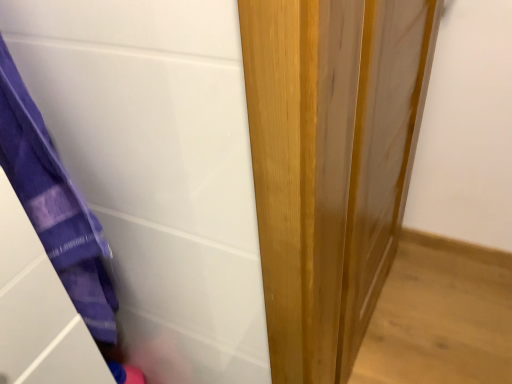
Image resolution: width=512 pixels, height=384 pixels. Find the location of `purple fabric at left`. purple fabric at left is located at coordinates (158, 167).

What is the approximate height of purple fabric at left?

purple fabric at left is 28.17 inches tall.

The width and height of the screenshot is (512, 384). Describe the element at coordinates (158, 167) in the screenshot. I see `purple fabric at left` at that location.

What is the approximate width of wooden door at center?

4.20 inches.

Identify the location of wooden door at center. (331, 164).

This screenshot has width=512, height=384. Describe the element at coordinates (331, 164) in the screenshot. I see `wooden door at center` at that location.

Identify the location of purple fabric at left. (158, 167).

Which object is positioned more to the left, purple fabric at left or wooden door at center?

Positioned to the left is purple fabric at left.

Looking at this image, does purple fabric at left lie in front of wooden door at center?

Yes, it is.

Is point (3, 37) more distant than point (394, 178)?

No, (3, 37) is in front of (394, 178).

From the image's perspective, would you say purple fabric at left is shown under wooden door at center?

Yes, from the image's perspective, purple fabric at left is below wooden door at center.

From a real-world perspective, which object rests below the other?

In real-world perspective, wooden door at center is lower.

Considering the sizes of objects purple fabric at left and wooden door at center in the image provided, who is wider, purple fabric at left or wooden door at center?

Wider between the two is purple fabric at left.

Considering the sizes of objects purple fabric at left and wooden door at center in the image provided, who is taller, purple fabric at left or wooden door at center?

wooden door at center is taller.

Can you confirm if purple fabric at left is smaller than wooden door at center?

Yes, purple fabric at left is smaller than wooden door at center.

Is purple fabric at left outside of wooden door at center?

Indeed, purple fabric at left is completely outside wooden door at center.

Is purple fabric at left touching wooden door at center?

No, purple fabric at left is not in contact with wooden door at center.

Is purple fabric at left looking in the opposite direction of wooden door at center?

That's not correct — purple fabric at left is not looking away from wooden door at center.

How many degrees apart are the facing directions of purple fabric at left and wooden door at center?

The angle between the facing direction of purple fabric at left and the facing direction of wooden door at center is 0.947 degrees.

Measure the distance from purple fabric at left to wooden door at center.

purple fabric at left and wooden door at center are 10.08 inches apart.

Find the location of a particular element. screen door above the wooden door at center (from a real-world perspective) is located at coordinates (158, 167).

Does wooden door at center appear on the right side of purple fabric at left?

Correct, you'll find wooden door at center to the right of purple fabric at left.

In the image, is wooden door at center positioned in front of or behind purple fabric at left?

wooden door at center is positioned farther from the viewer than purple fabric at left.

Which is in front, point (379, 148) or point (208, 86)?

The point (208, 86) is closer.

From the image's perspective, between wooden door at center and purple fabric at left, who is located below?

From the image's view, purple fabric at left is below.

From a real-world perspective, which is physically above, wooden door at center or purple fabric at left?

purple fabric at left, from a real-world perspective.

Between wooden door at center and purple fabric at left, which one has larger width?

With larger width is purple fabric at left.

Considering the sizes of objects wooden door at center and purple fabric at left in the image provided, who is shorter, wooden door at center or purple fabric at left?

Standing shorter between the two is purple fabric at left.

In terms of size, does wooden door at center appear bigger or smaller than purple fabric at left?

Clearly, wooden door at center is larger in size than purple fabric at left.

Is wooden door at center not inside purple fabric at left?

Indeed, wooden door at center is completely outside purple fabric at left.

Is wooden door at center far from purple fabric at left?

No, wooden door at center is not far away from purple fabric at left.

From the picture: Is wooden door at center facing away from purple fabric at left?

No, purple fabric at left is not at the back of wooden door at center.

Can you tell me how much wooden door at center and purple fabric at left differ in facing direction?

0.947 degrees separate the facing orientations of wooden door at center and purple fabric at left.

At what (x,y) coordinates should I click in order to perform the action: click on door that appears above the purple fabric at left (from the image's perspective). Please return your answer as a coordinate pair (x, y). This screenshot has height=384, width=512. Looking at the image, I should click on (331, 164).

Locate an element on the screen. The height and width of the screenshot is (384, 512). screen door that is in front of the wooden door at center is located at coordinates (158, 167).

Where is `screen door above the wooden door at center (from a real-world perspective)`? The image size is (512, 384). screen door above the wooden door at center (from a real-world perspective) is located at coordinates (158, 167).